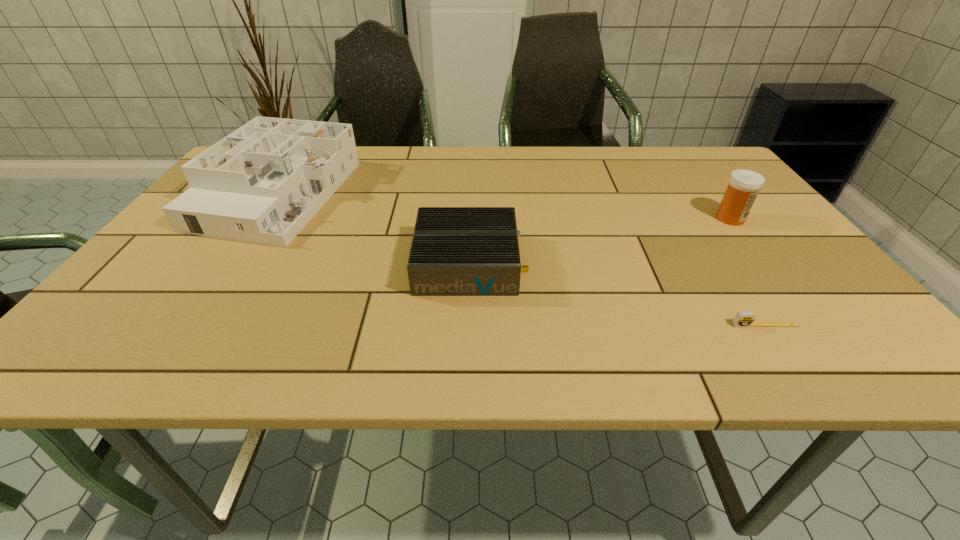
At what (x,y) coordinates should I click in order to perform the action: click on object located in the far edge section of the desktop. Please return your answer as a coordinate pair (x, y). The height and width of the screenshot is (540, 960). Looking at the image, I should click on (263, 183).

What are the coordinates of `object situated at the left edge` in the screenshot? It's located at (263, 183).

Find the location of a particular element. medicine positioned at the right edge is located at coordinates (743, 186).

This screenshot has width=960, height=540. Identify the location of tape measure located at the right edge. (743, 318).

This screenshot has width=960, height=540. I want to click on object present at the far left corner, so click(x=263, y=183).

Where is `vacant space at the far edge of the desktop`? This screenshot has width=960, height=540. vacant space at the far edge of the desktop is located at coordinates (452, 160).

The image size is (960, 540). In order to click on vacant area at the near edge of the desktop in this screenshot , I will do `click(652, 340)`.

In the image, there is a desktop. Identify the location of vacant space at the left edge. (187, 247).

At what (x,y) coordinates should I click in order to perform the action: click on vacant space at the right edge of the desktop. Please return your answer as a coordinate pair (x, y). Looking at the image, I should click on (847, 322).

This screenshot has width=960, height=540. What are the coordinates of `vacant space at the near left corner of the desktop` in the screenshot? It's located at (146, 336).